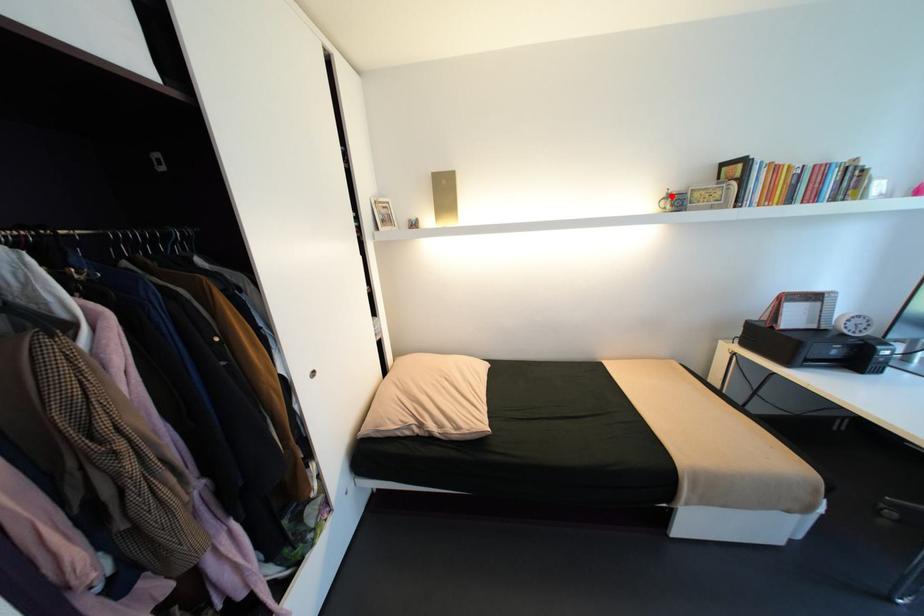
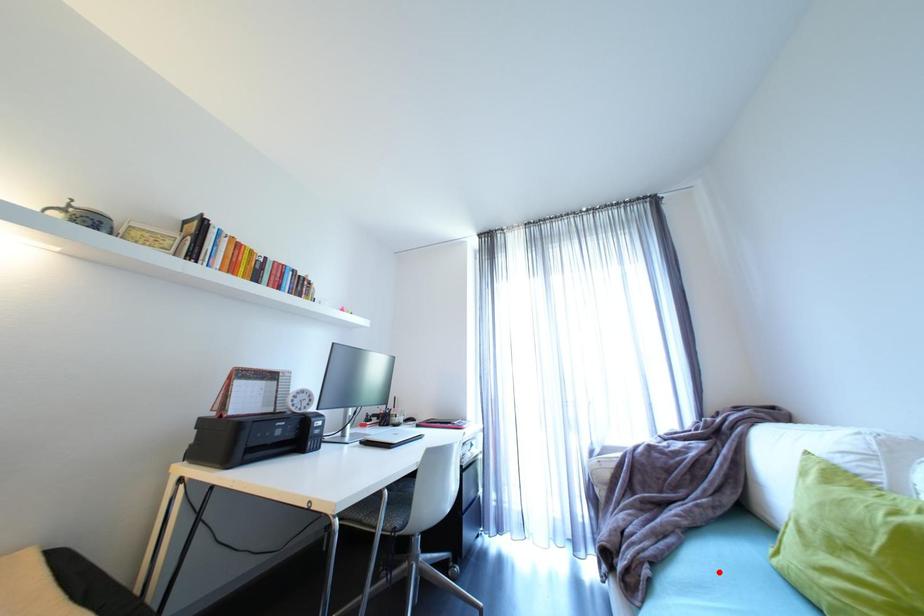
I am providing you with two images of the same scene from different viewpoints. A red point is marked on the first image and another point is marked on the second image. Does the point marked in image1 correspond to the same location as the one in image2?

No